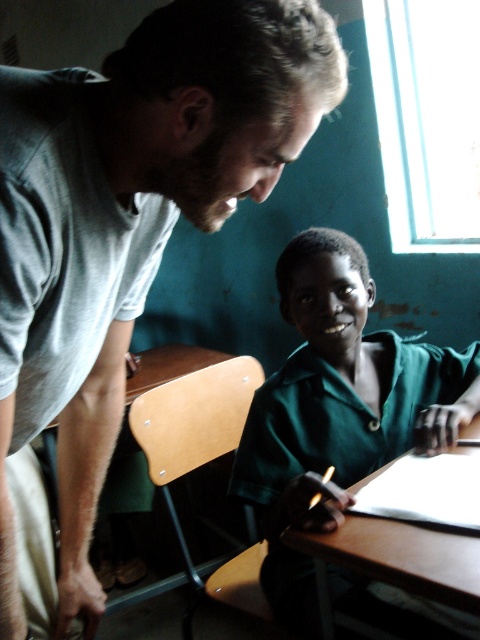
Based on the photo, is gray cotton shirt at upper left closer to camera compared to brown wooden table at lower center?

Yes.

Locate an element on the screen. The height and width of the screenshot is (640, 480). gray cotton shirt at upper left is located at coordinates (129, 224).

The width and height of the screenshot is (480, 640). Identify the location of gray cotton shirt at upper left. (129, 224).

Does green matte uniform at center have a lesser width compared to brown wooden table at lower center?

No, green matte uniform at center is not thinner than brown wooden table at lower center.

Is point (288, 304) farther from camera compared to point (333, 541)?

Yes, it is behind point (333, 541).

The width and height of the screenshot is (480, 640). In order to click on green matte uniform at center in this screenshot , I will do `click(337, 406)`.

Does gray cotton shirt at upper left have a lesser height compared to green matte uniform at center?

Incorrect, gray cotton shirt at upper left's height does not fall short of green matte uniform at center's.

Between point (180, 88) and point (314, 234), which one is positioned in front?

Point (180, 88)

Locate an element on the screen. This screenshot has width=480, height=640. gray cotton shirt at upper left is located at coordinates (129, 224).